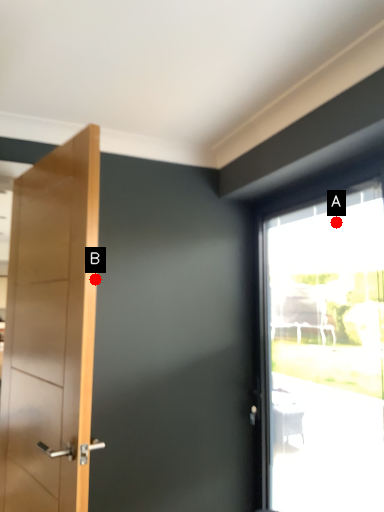
Question: Two points are circled on the image, labeled by A and B beside each circle. Which of the following is the farthest from the observer?

Choices:
 (A) A is further
 (B) B is further

Answer: (A)